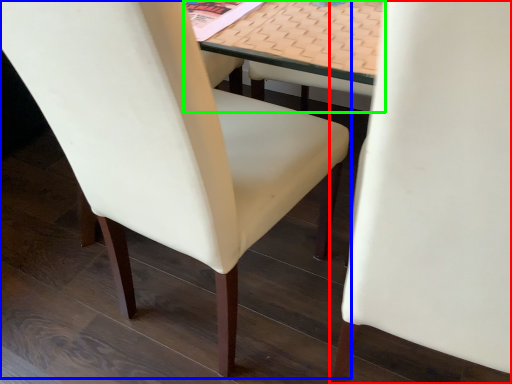
Question: Which object is the closest to the chair (highlighted by a red box)? Choose among these: chair (highlighted by a blue box) or table (highlighted by a green box).

Choices:
 (A) chair
 (B) table

Answer: (B)